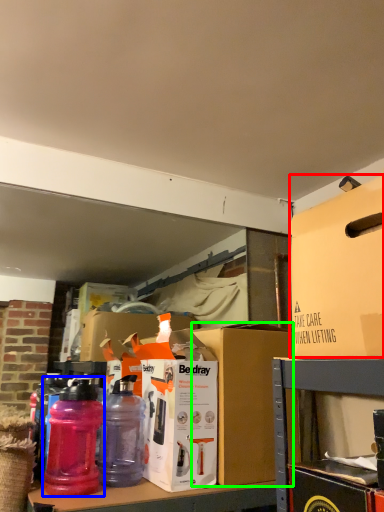
Question: Which is farther away from box (highlighted by a red box)? bottle (highlighted by a blue box) or storage box (highlighted by a green box)?

Choices:
 (A) bottle
 (B) storage box

Answer: (A)